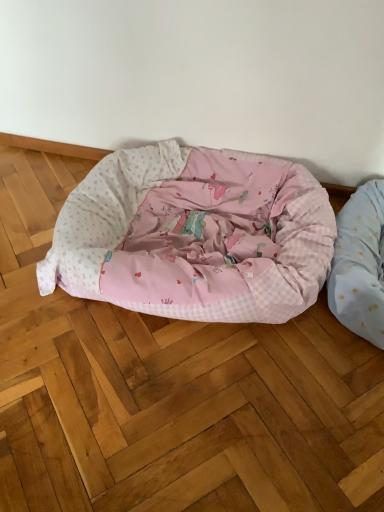
Find the location of a particular element. This screenshot has width=384, height=512. pink checkered fabric dog bed at center is located at coordinates (194, 234).

This screenshot has height=512, width=384. What do you see at coordinates (194, 234) in the screenshot? I see `pink checkered fabric dog bed at center` at bounding box center [194, 234].

Image resolution: width=384 pixels, height=512 pixels. What are the coordinates of `pink checkered fabric dog bed at center` in the screenshot? It's located at [194, 234].